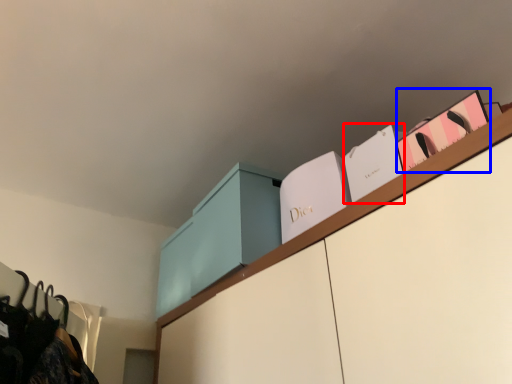
Question: Which point is further to the camera, book (highlighted by a red box) or book (highlighted by a blue box)?

Choices:
 (A) book
 (B) book

Answer: (A)